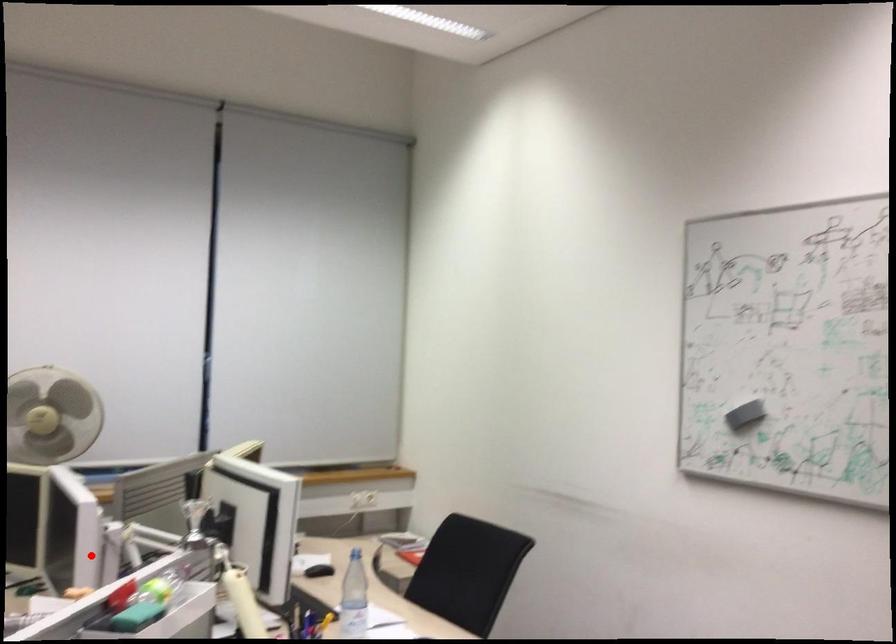
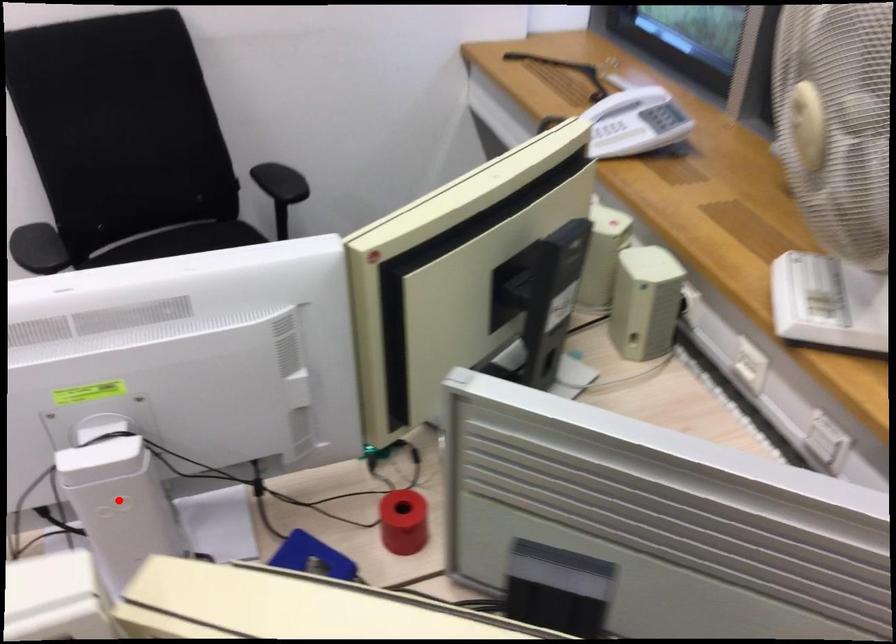
I am providing you with two images of the same scene from different viewpoints. A red point is marked on the first image and another point is marked on the second image. Do the highlighted points in image1 and image2 indicate the same real-world spot?

Yes